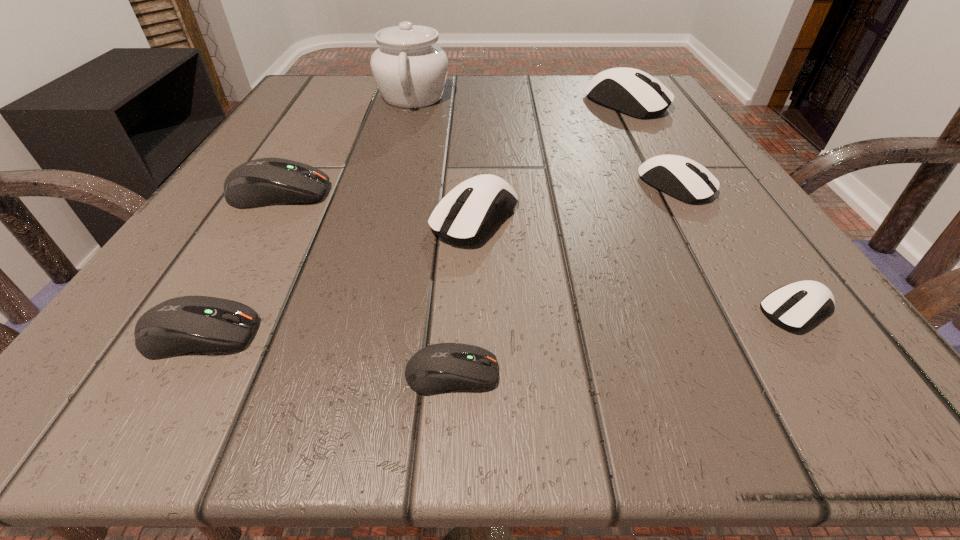
Image resolution: width=960 pixels, height=540 pixels. In order to click on vacant space located on the left of the white chinaware in this screenshot , I will do `click(332, 97)`.

Where is `free space located 0.110m on the left of the farthest white mouse`? The height and width of the screenshot is (540, 960). free space located 0.110m on the left of the farthest white mouse is located at coordinates (532, 104).

I want to click on vacant space situated on the right of the second biggest white mouse, so click(678, 218).

At what (x,y) coordinates should I click in order to perform the action: click on vacant area situated 0.320m on the button of the farthest dark computer equipment. Please return your answer as a coordinate pair (x, y). This screenshot has height=540, width=960. Looking at the image, I should click on (545, 193).

This screenshot has height=540, width=960. Find the location of `free location located on the front of the third biggest white mouse`. free location located on the front of the third biggest white mouse is located at coordinates (776, 356).

You are a GUI agent. You are given a task and a screenshot of the screen. Output one action in this format:
    pyautogui.click(x=<x>, y=<y>)
    Task: Click on the free space located 0.360m on the button of the second smallest dark computer equipment
    This screenshot has width=960, height=540.
    Given the screenshot: What is the action you would take?
    pyautogui.click(x=599, y=334)

The height and width of the screenshot is (540, 960). I want to click on blank space located on the back of the nearest white mouse, so click(x=720, y=200).

Where is `vacant space located 0.130m on the button of the smallest dark computer equipment`? The height and width of the screenshot is (540, 960). vacant space located 0.130m on the button of the smallest dark computer equipment is located at coordinates (632, 373).

Find the location of a particular element. The height and width of the screenshot is (540, 960). chinaware that is positioned at the far edge is located at coordinates (410, 70).

At what (x,y) coordinates should I click in order to perform the action: click on mouse present at the far edge. Please return your answer as a coordinate pair (x, y). This screenshot has height=540, width=960. Looking at the image, I should click on (633, 92).